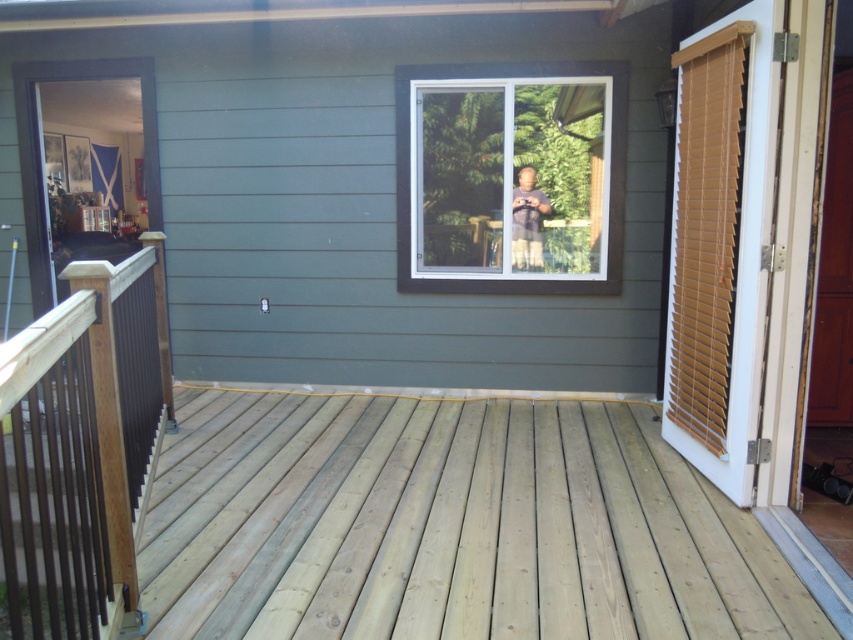
You are standing on the deck and want to go to the tan wood blinds at right. Which direction should you walk from your current position at point (720,246)?

The point (720,246) indicates the tan wood blinds at right, so you are already at the location of the tan wood blinds at right.